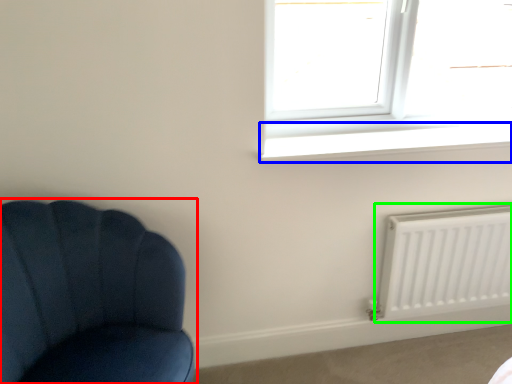
Question: Estimate the real-world distances between objects in this image. Which object is closer to chair (highlighted by a red box), window sill (highlighted by a blue box) or radiator (highlighted by a green box)?

Choices:
 (A) window sill
 (B) radiator

Answer: (A)